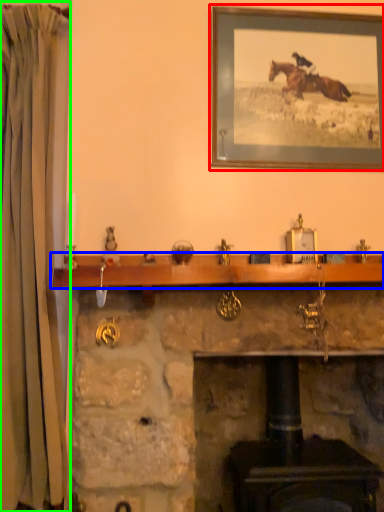
Question: Which object is the farthest from picture frame (highlighted by a red box)? Choose among these: mantle (highlighted by a blue box) or curtain (highlighted by a green box).

Choices:
 (A) mantle
 (B) curtain

Answer: (B)